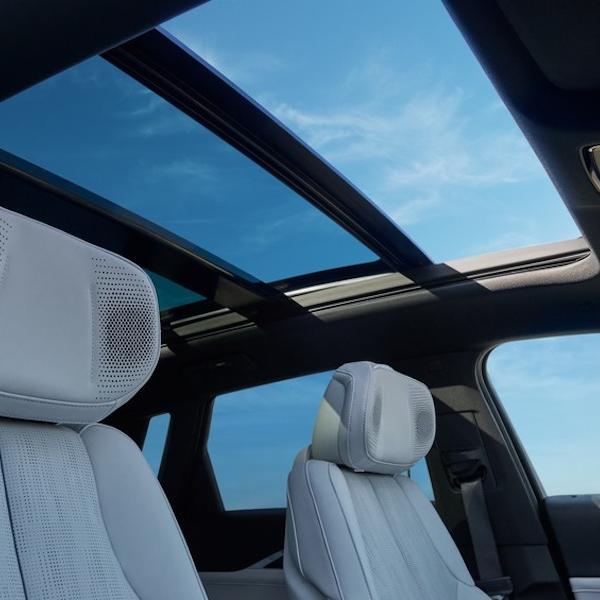
Identify the location of air vents. (52, 500).